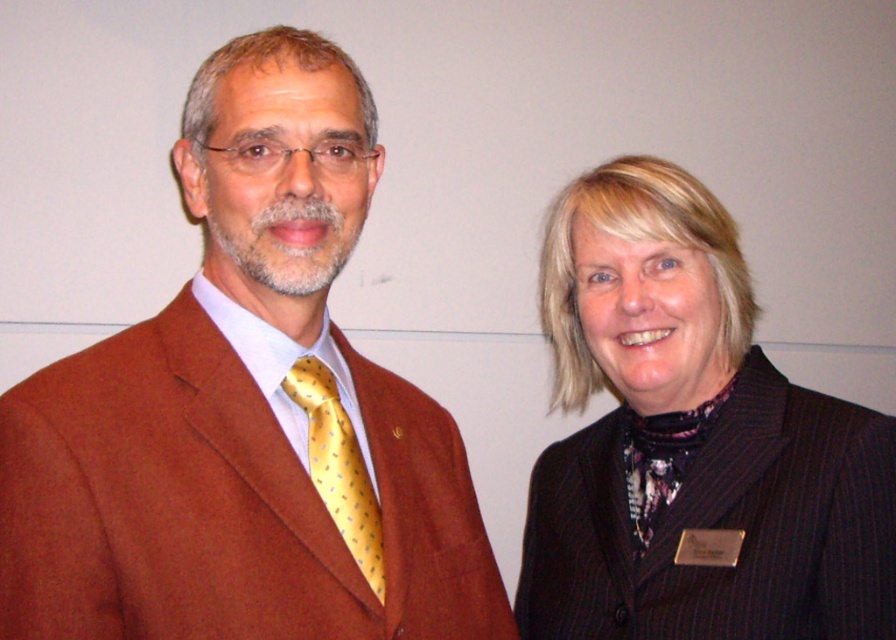
Between point (54, 595) and point (337, 449), which one is positioned in front?

Point (54, 595)

Can you confirm if brown woolen suit at left is positioned to the left of yellow dotted silk tie at left?

Indeed, brown woolen suit at left is positioned on the left side of yellow dotted silk tie at left.

Which is in front, point (4, 630) or point (307, 436)?

Point (4, 630)

You are a GUI agent. You are given a task and a screenshot of the screen. Output one action in this format:
    pyautogui.click(x=<x>, y=<y>)
    Task: Click on the brown woolen suit at left
    
    Given the screenshot: What is the action you would take?
    pyautogui.click(x=246, y=412)

Is point (145, 333) farther from camera compared to point (714, 292)?

No.

You are a GUI agent. You are given a task and a screenshot of the screen. Output one action in this format:
    pyautogui.click(x=<x>, y=<y>)
    Task: Click on the brown woolen suit at left
    Image resolution: width=896 pixels, height=640 pixels.
    Given the screenshot: What is the action you would take?
    pyautogui.click(x=246, y=412)

Can you confirm if black pinstripe blazer at right is thinner than yellow dotted silk tie at left?

No, black pinstripe blazer at right is not thinner than yellow dotted silk tie at left.

Which is above, black pinstripe blazer at right or yellow dotted silk tie at left?

black pinstripe blazer at right is higher up.

The width and height of the screenshot is (896, 640). Find the location of `black pinstripe blazer at right`. black pinstripe blazer at right is located at coordinates (691, 442).